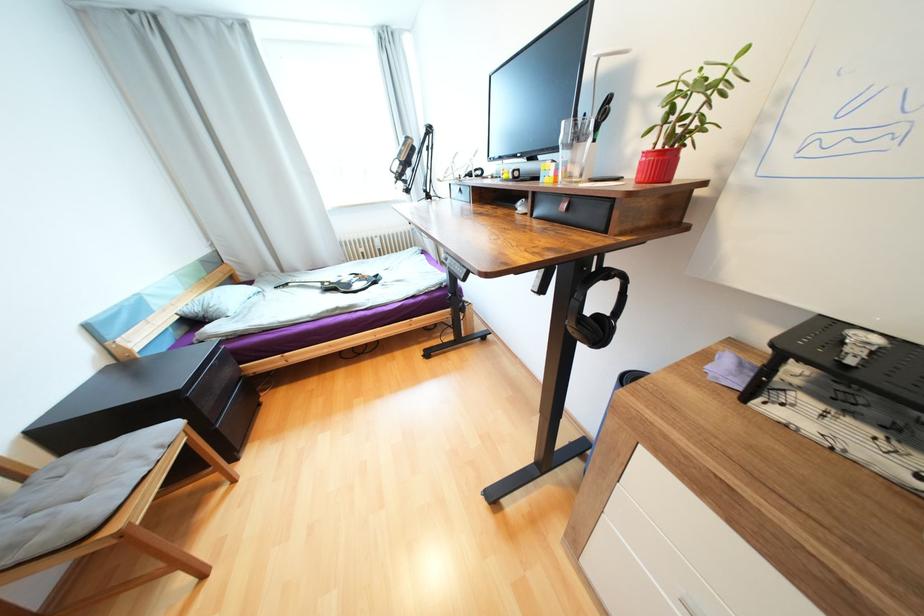
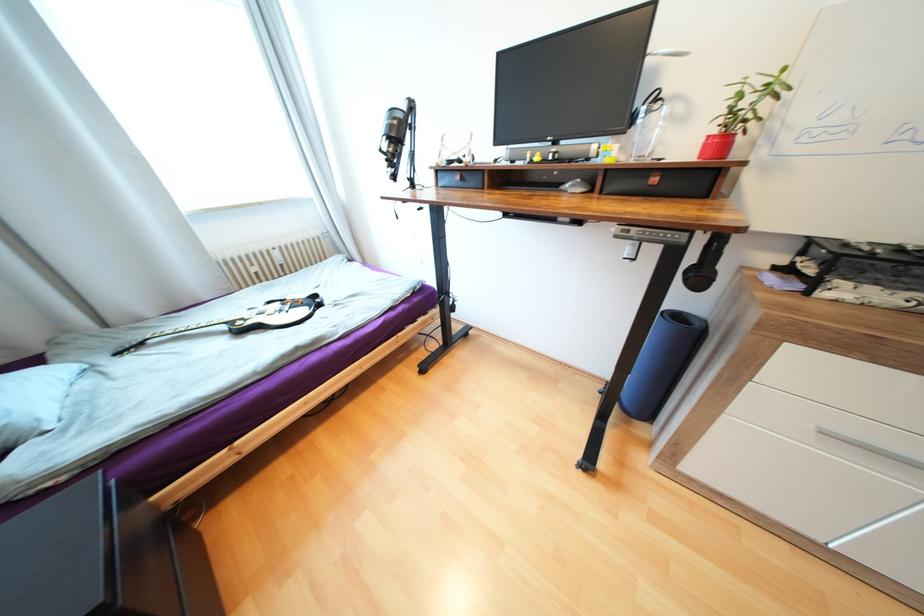
Locate, in the second image, the point that corresponds to pixel 325 285 in the first image.

(229, 328)